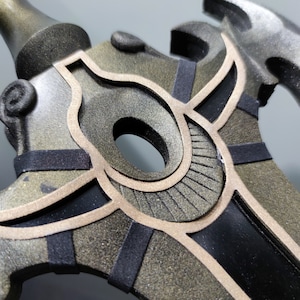
At what (x,y) coordinates should I click in order to perform the action: click on iron. Please return your answer as a coordinate pair (x, y). The image size is (300, 300). Looking at the image, I should click on (48, 115).